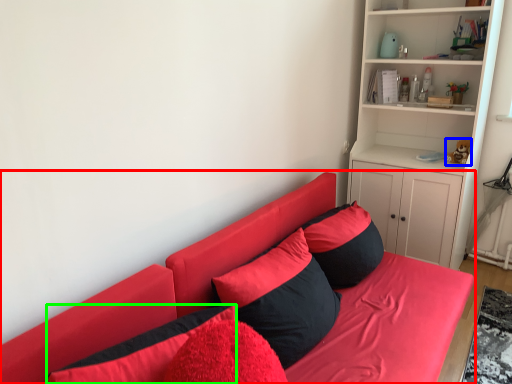
Question: Which is farther away from studio couch (highlighted by a red box)? toy (highlighted by a blue box) or pillow (highlighted by a green box)?

Choices:
 (A) toy
 (B) pillow

Answer: (A)